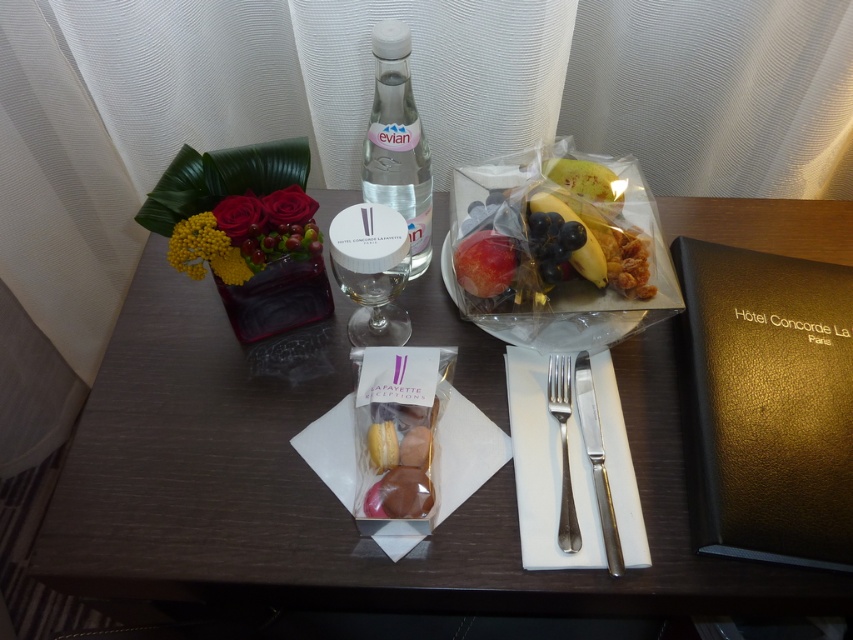
Who is lower down, wooden table at center or transparent glass bottle at center?

wooden table at center is below.

Is point (381, 586) positioned in front of point (368, 168)?

That is True.

Locate an element on the screen. Image resolution: width=853 pixels, height=640 pixels. wooden table at center is located at coordinates (329, 492).

Does transparent glass bottle at center have a greater width compared to red glossy apple at center?

Correct, the width of transparent glass bottle at center exceeds that of red glossy apple at center.

Between point (410, 184) and point (486, 253), which one is positioned behind?

Positioned behind is point (410, 184).

Identify the location of transparent glass bottle at center. This screenshot has height=640, width=853. (397, 141).

Is point (231, 577) positioned after point (573, 177)?

No.

Is wooden table at center thinner than translucent plastic bag of fruit at center?

In fact, wooden table at center might be wider than translucent plastic bag of fruit at center.

Which is behind, point (100, 442) or point (556, 256)?

Point (556, 256)

The height and width of the screenshot is (640, 853). Identify the location of wooden table at center. (329, 492).